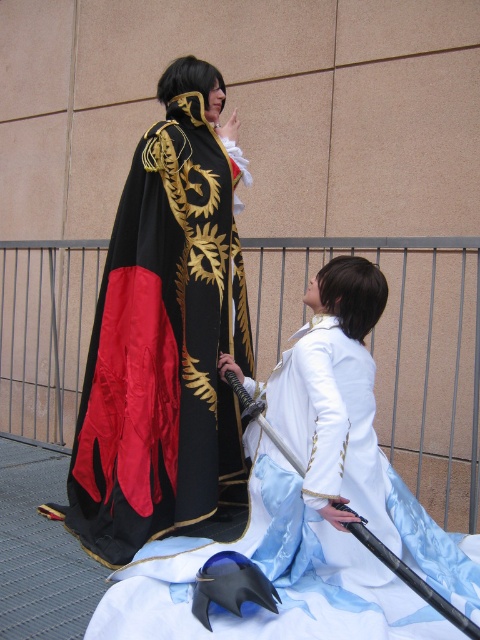
Between velvet black cape at center and satin white dress at center, which one has less height?

Standing shorter between the two is satin white dress at center.

Locate an element on the screen. Image resolution: width=480 pixels, height=640 pixels. velvet black cape at center is located at coordinates (167, 340).

The width and height of the screenshot is (480, 640). I want to click on velvet black cape at center, so tap(167, 340).